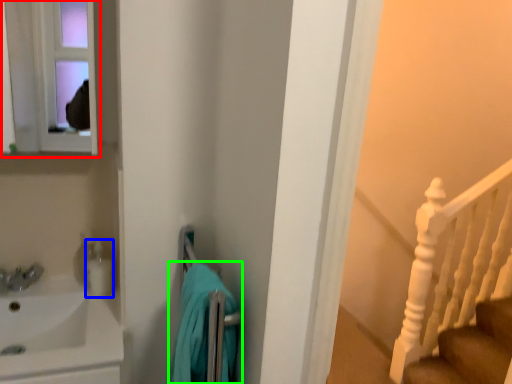
Question: Which is nearer to the medicine cabinet (highlighted by a red box)? toiletry (highlighted by a blue box) or bath towel (highlighted by a green box).

Choices:
 (A) toiletry
 (B) bath towel

Answer: (A)